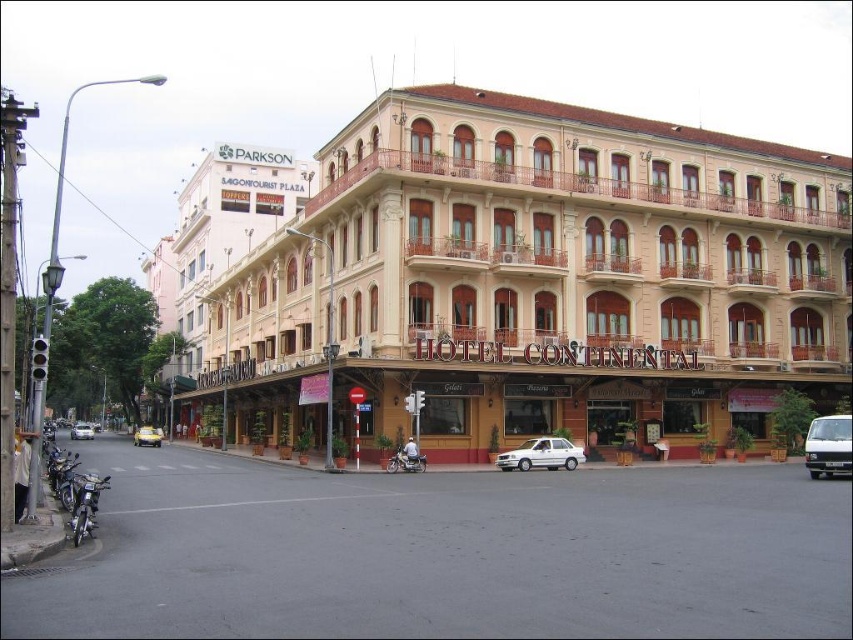
Does white matte van at center appear on the left side of yellow matte taxi at lower left?

In fact, white matte van at center is to the right of yellow matte taxi at lower left.

Who is positioned more to the right, white matte van at center or yellow matte taxi at lower left?

Positioned to the right is white matte van at center.

Measure the distance between white matte van at center and camera.

white matte van at center is 54.91 meters away from camera.

Identify the location of white matte van at center. (828, 445).

Who is taller, metallic silver motorcycle at lower left or metallic silver motorcycle at center?

metallic silver motorcycle at lower left

Does metallic silver motorcycle at lower left have a larger size compared to metallic silver motorcycle at center?

Indeed, metallic silver motorcycle at lower left has a larger size compared to metallic silver motorcycle at center.

Which is behind, point (76, 500) or point (415, 465)?

The point (415, 465) is more distant.

The height and width of the screenshot is (640, 853). I want to click on metallic silver motorcycle at lower left, so click(x=85, y=502).

Can you confirm if white matte sedan at center is bigger than silver metallic car at lower left?

No.

Between white matte sedan at center and silver metallic car at lower left, which one is positioned lower?

Positioned lower is silver metallic car at lower left.

What do you see at coordinates (541, 454) in the screenshot?
I see `white matte sedan at center` at bounding box center [541, 454].

At what (x,y) coordinates should I click in order to perform the action: click on white matte sedan at center. Please return your answer as a coordinate pair (x, y). Image resolution: width=853 pixels, height=640 pixels. Looking at the image, I should click on (541, 454).